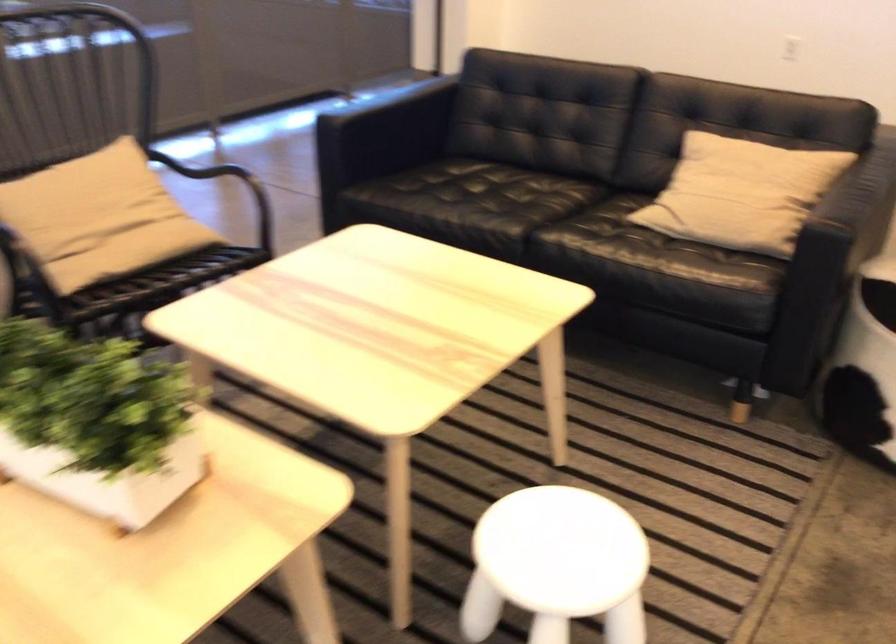
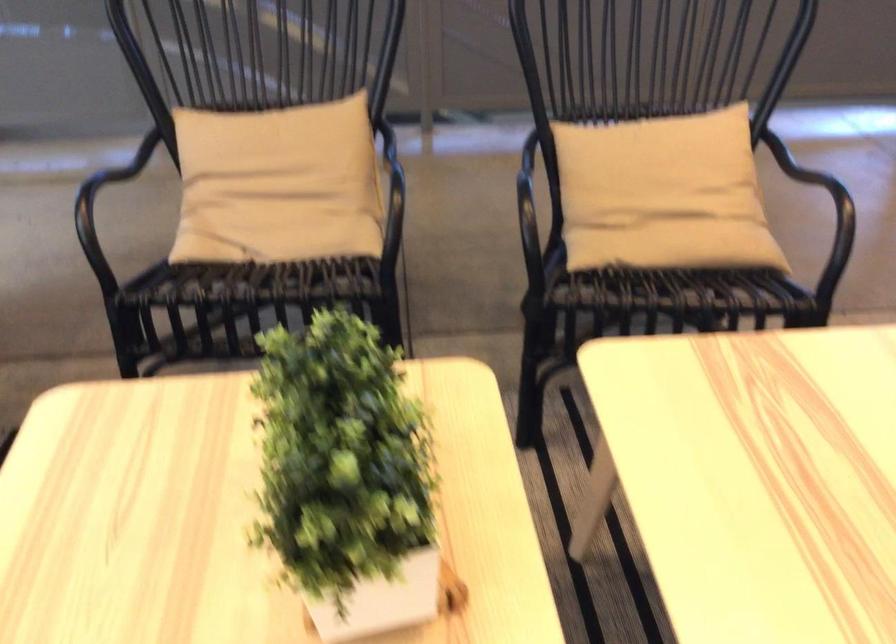
Question: The camera is either moving clockwise (left) or counter-clockwise (right) around the object. The first image is from the beginning of the video and the second image is from the end. Is the camera moving left or right when shooting the video?

Choices:
 (A) Left
 (B) Right

Answer: (B)